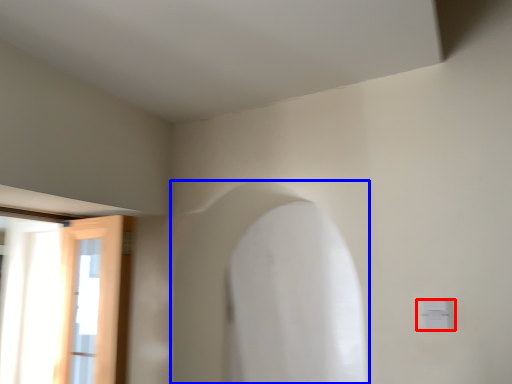
Question: Which object is closer to the camera taking this photo, electric outlet (highlighted by a red box) or archway (highlighted by a blue box)?

Choices:
 (A) electric outlet
 (B) archway

Answer: (A)